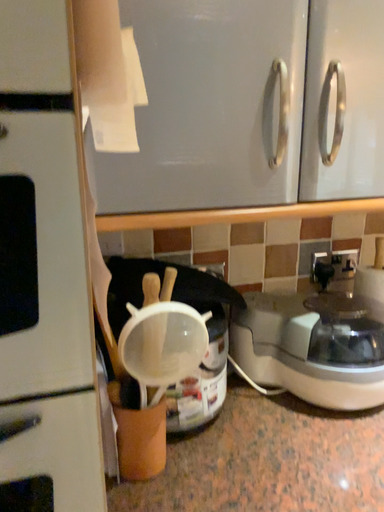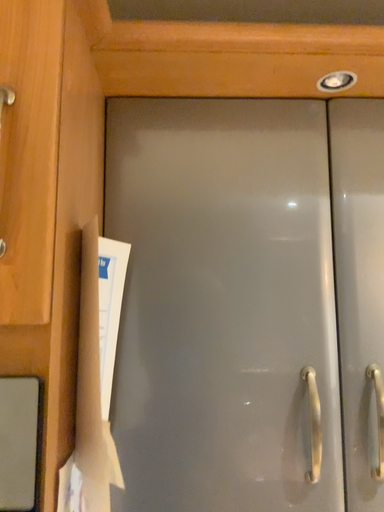
Question: Which way did the camera rotate in the video?

Choices:
 (A) rotated right
 (B) rotated left

Answer: (B)